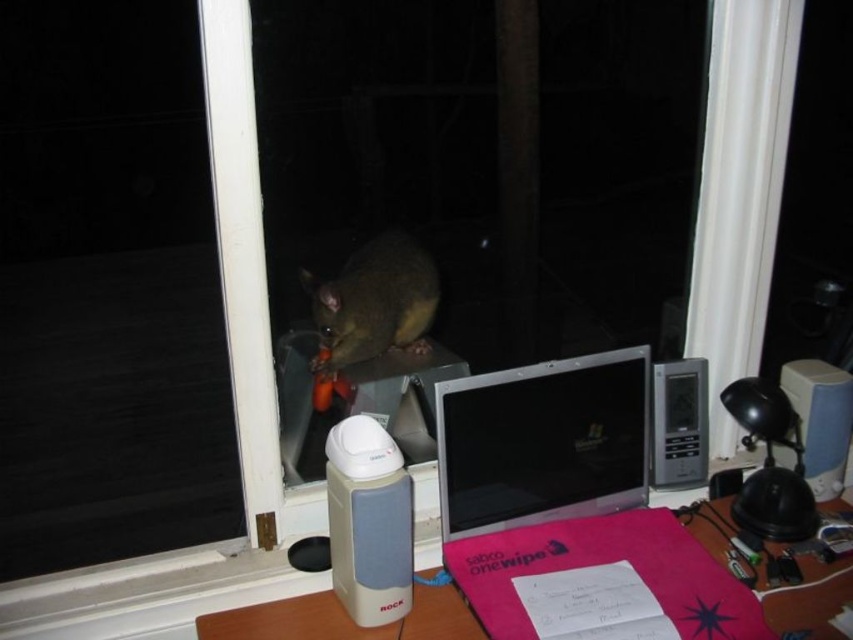
Which is below, brown furry possum at center or beige plastic speaker at lower center?

beige plastic speaker at lower center is below.

Does point (328, 291) come in front of point (389, 604)?

No, (328, 291) is behind (389, 604).

Identify the location of brown furry possum at center. pos(374,301).

Who is more distant from viewer, (547,403) or (447,634)?

Positioned behind is point (547,403).

Can you confirm if silver metallic laptop at center is positioned above white plastic speaker at lower left?

Yes, silver metallic laptop at center is above white plastic speaker at lower left.

The image size is (853, 640). What are the coordinates of `silver metallic laptop at center` in the screenshot? It's located at (543, 442).

Is silver metallic laptop at center to the right of brown furry possum at center from the viewer's perspective?

Indeed, silver metallic laptop at center is positioned on the right side of brown furry possum at center.

Between point (468, 486) and point (422, 284), which one is positioned behind?

The point (422, 284) is behind.

Is point (457, 461) positioned behind point (323, 358)?

No.

Locate an element on the screen. The width and height of the screenshot is (853, 640). silver metallic laptop at center is located at coordinates (x=543, y=442).